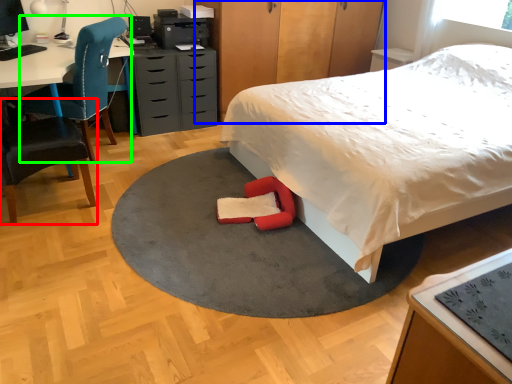
Question: Estimate the real-world distances between objects in this image. Which object is farther from chair (highlighted by a red box), dresser (highlighted by a blue box) or chair (highlighted by a green box)?

Choices:
 (A) dresser
 (B) chair

Answer: (A)